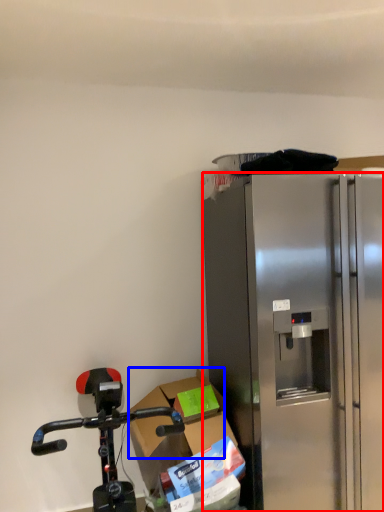
Question: Which object appears farthest to the camera in this image, refrigerator (highlighted by a red box) or box (highlighted by a blue box)?

Choices:
 (A) refrigerator
 (B) box

Answer: (B)